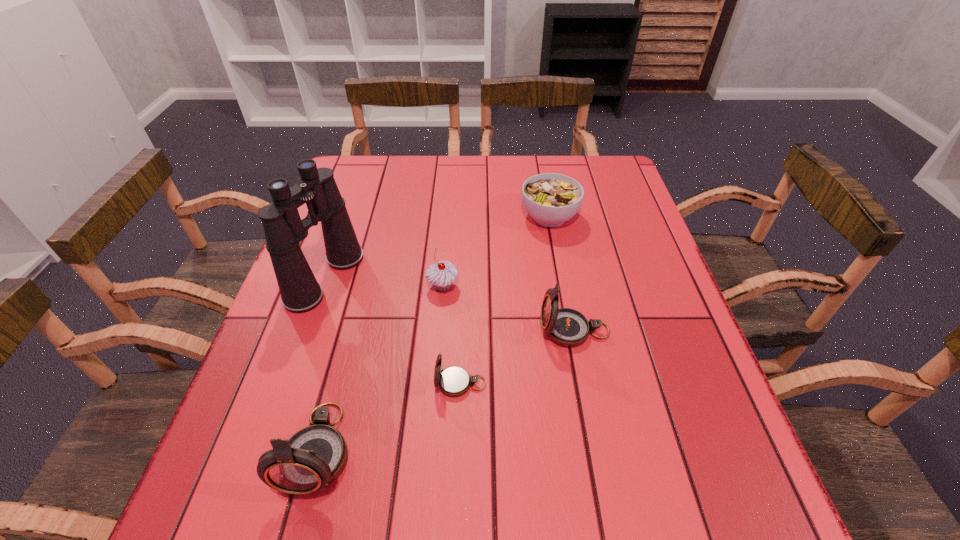
Find the location of a particular element. This screenshot has height=540, width=960. free space for a new compass on the right is located at coordinates (668, 287).